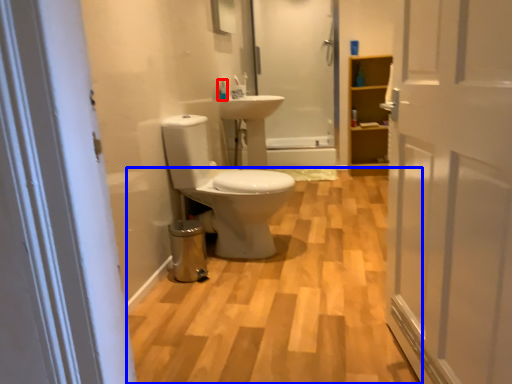
Question: Among these objects, which one is farthest to the camera, toiletry (highlighted by a red box) or plain (highlighted by a blue box)?

Choices:
 (A) toiletry
 (B) plain

Answer: (A)